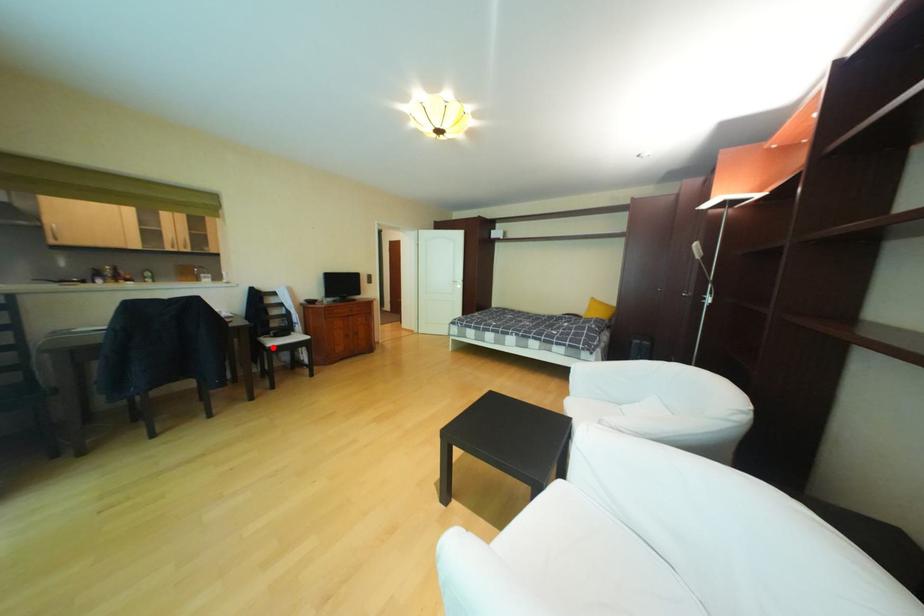
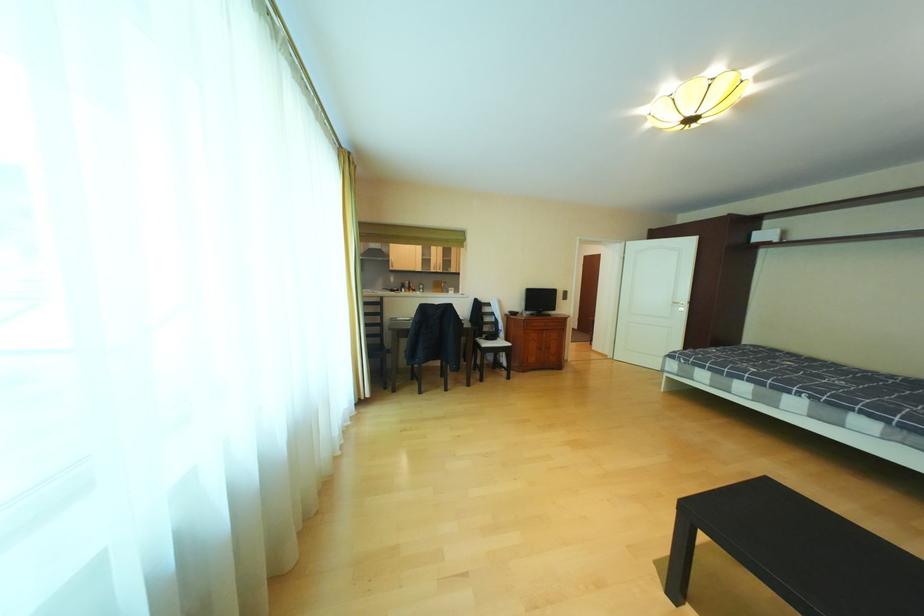
Find the pixel in the second image that matches the highlighted location in the first image.

(490, 346)